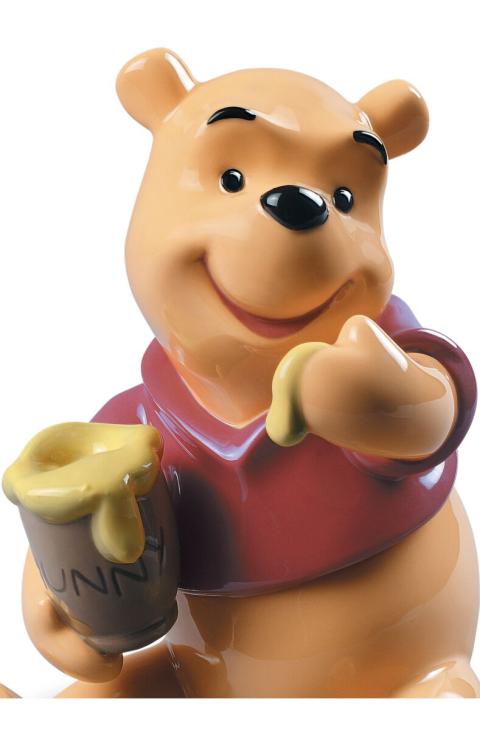
This screenshot has width=480, height=730. Identify the location of pot. (70, 548).